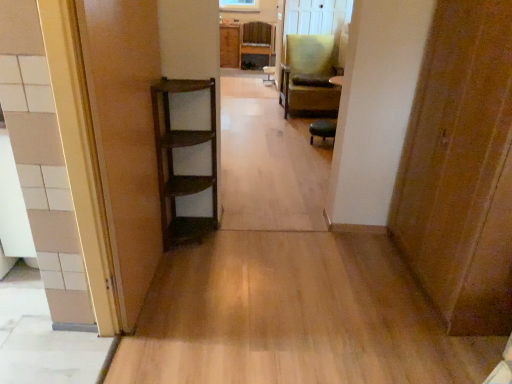
Question: In which direction should I rotate to look at green fabric chair at center, acting as the second chair starting from the left?

Choices:
 (A) left
 (B) right

Answer: (B)

Question: From the image's perspective, does wooden chair at center, positioned as the second chair in right-to-left order, appear higher than wooden door at left, the 1th door from the left?

Choices:
 (A) no
 (B) yes

Answer: (B)

Question: Considering the relative sizes of wooden chair at center, placed as the 2th chair when sorted from front to back, and wooden door at left, the second door positioned from the right, in the image provided, is wooden chair at center, placed as the 2th chair when sorted from front to back, taller than wooden door at left, the second door positioned from the right,?

Choices:
 (A) yes
 (B) no

Answer: (B)

Question: From the image's perspective, is wooden chair at center, which is the 1th chair from back to front, located beneath wooden door at left, the 1th door from the left?

Choices:
 (A) yes
 (B) no

Answer: (B)

Question: From a real-world perspective, is wooden chair at center, positioned as the second chair in right-to-left order, below wooden door at left, the second door positioned from the right?

Choices:
 (A) no
 (B) yes

Answer: (B)

Question: Does wooden chair at center, placed as the 2th chair when sorted from front to back, have a smaller size compared to wooden door at left, the 1th door from the left?

Choices:
 (A) yes
 (B) no

Answer: (B)

Question: Is wooden chair at center, acting as the 1th chair starting from the left, wider than wooden door at left, the 1th door from the left?

Choices:
 (A) yes
 (B) no

Answer: (A)

Question: From a real-world perspective, is wooden door at left, the second door positioned from the right, physically below wooden cabinet at center?

Choices:
 (A) yes
 (B) no

Answer: (B)

Question: Can you confirm if wooden door at left, the 1th door from the left, is thinner than wooden cabinet at center?

Choices:
 (A) no
 (B) yes

Answer: (B)

Question: Can you confirm if wooden door at left, the second door positioned from the right, is taller than wooden cabinet at center?

Choices:
 (A) yes
 (B) no

Answer: (A)

Question: From a real-world perspective, does wooden door at left, the second door positioned from the right, stand above wooden cabinet at center?

Choices:
 (A) yes
 (B) no

Answer: (A)

Question: Does wooden door at left, the second door positioned from the right, have a greater width compared to wooden cabinet at center?

Choices:
 (A) no
 (B) yes

Answer: (A)

Question: Considering the relative sizes of wooden door at left, the 1th door from the left, and wooden cabinet at center in the image provided, is wooden door at left, the 1th door from the left, bigger than wooden cabinet at center?

Choices:
 (A) yes
 (B) no

Answer: (B)

Question: Is the depth of wooden door at left, the second door positioned from the right, greater than that of wooden door at right, which is the first door in right-to-left order?

Choices:
 (A) no
 (B) yes

Answer: (A)